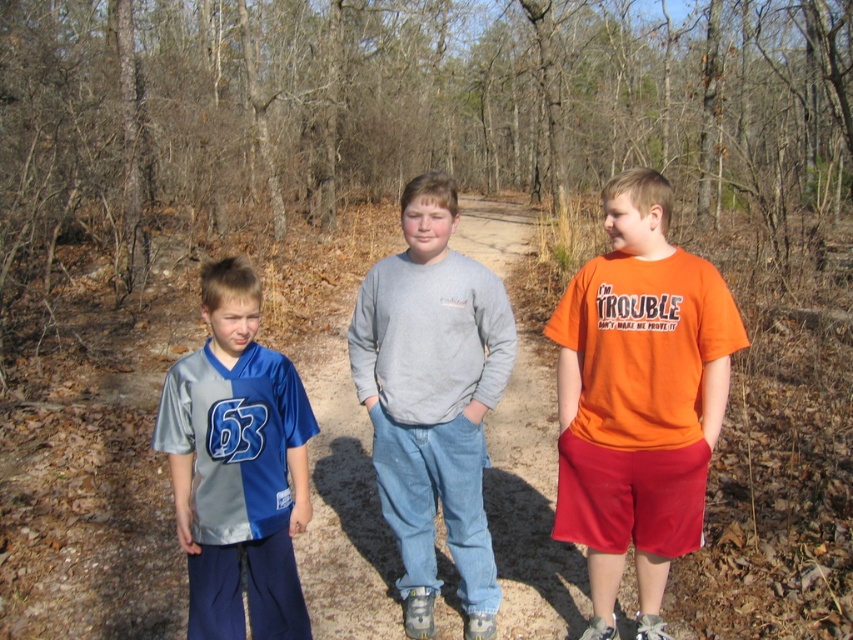
Is orange cotton t-shirt at right below shiny jersey at center?

No, orange cotton t-shirt at right is not below shiny jersey at center.

The image size is (853, 640). Identify the location of orange cotton t-shirt at right. (637, 397).

Find the location of a particular element. This screenshot has width=853, height=640. orange cotton t-shirt at right is located at coordinates (637, 397).

Where is `orange cotton t-shirt at right`? orange cotton t-shirt at right is located at coordinates (637, 397).

Is gray cotton sweatshirt at center wider than shiny jersey at center?

Yes, gray cotton sweatshirt at center is wider than shiny jersey at center.

Does point (434, 356) come closer to viewer compared to point (271, 588)?

That is False.

The width and height of the screenshot is (853, 640). What are the coordinates of `gray cotton sweatshirt at center` in the screenshot? It's located at (433, 401).